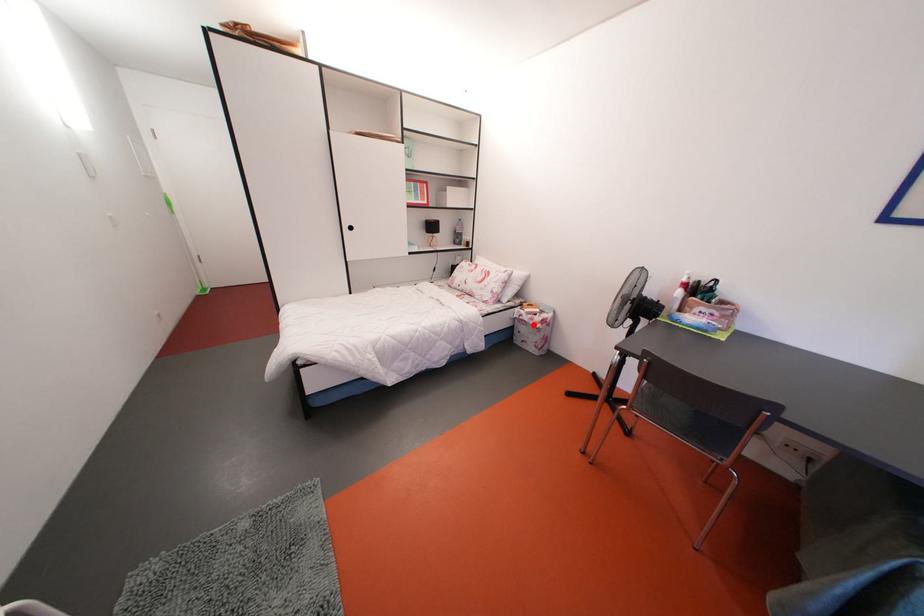
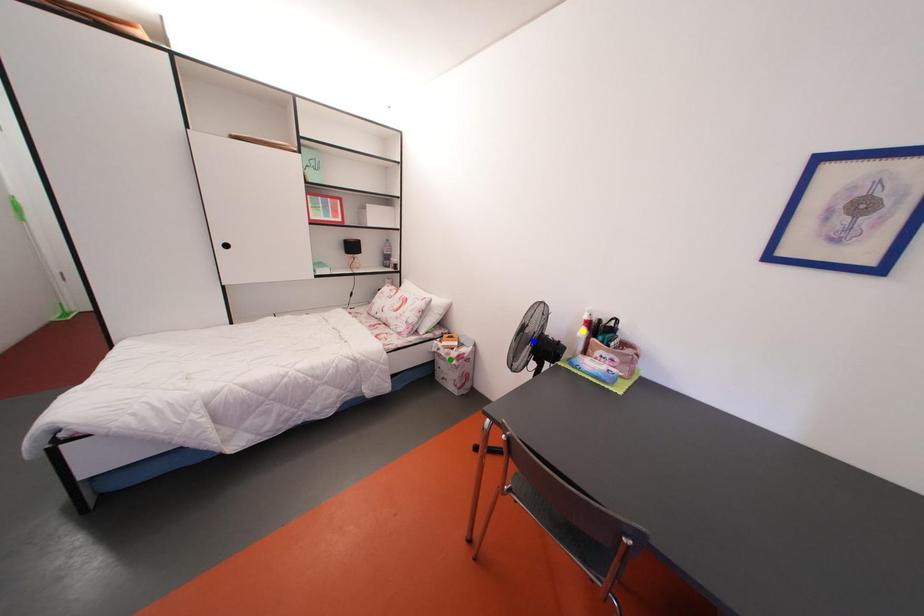
Question: I am providing you with two images of the same scene from different viewpoints. A red point is marked on the first image. You are given multiple points on the second image. Can you choose the point in image 2 that corresponds to the point in image 1?

Choices:
 (A) blue point
 (B) green point
 (C) yellow point

Answer: (B)